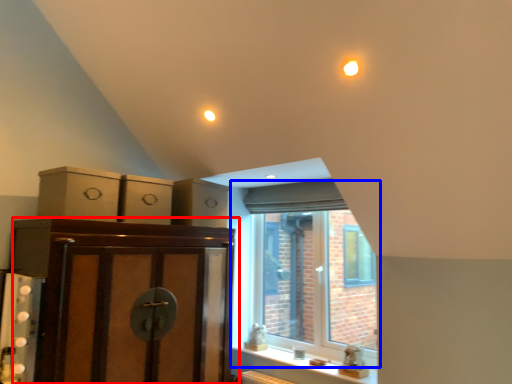
Question: Which point is closer to the camera, cabinetry (highlighted by a red box) or window (highlighted by a blue box)?

Choices:
 (A) cabinetry
 (B) window

Answer: (A)